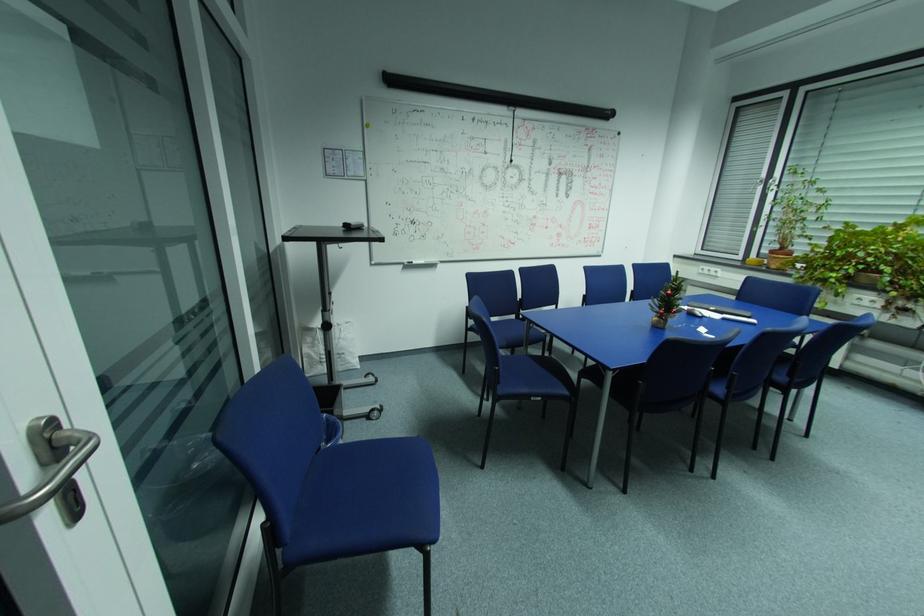
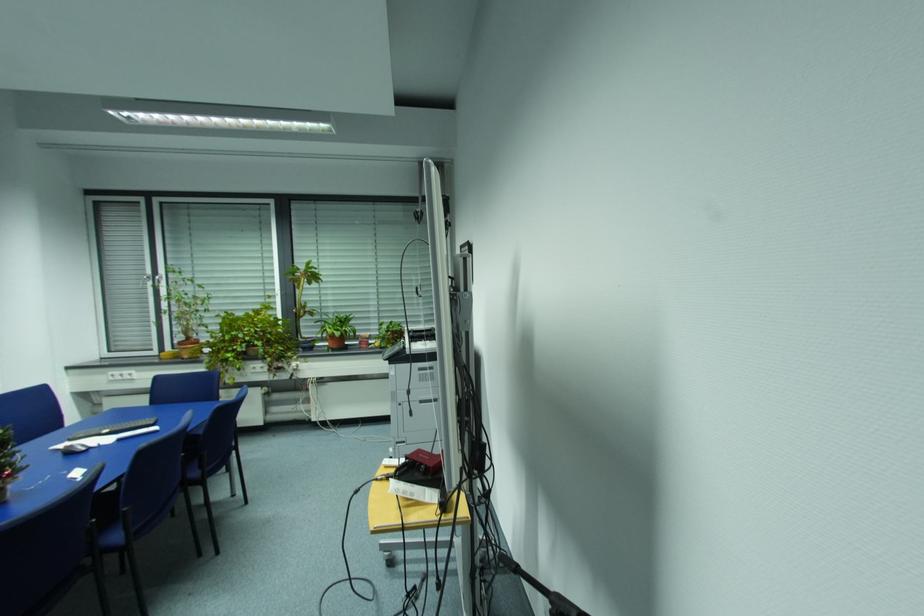
Question: The camera is either moving clockwise (left) or counter-clockwise (right) around the object. The first image is from the beginning of the video and the second image is from the end. Is the camera moving left or right when shooting the video?

Choices:
 (A) Left
 (B) Right

Answer: (A)